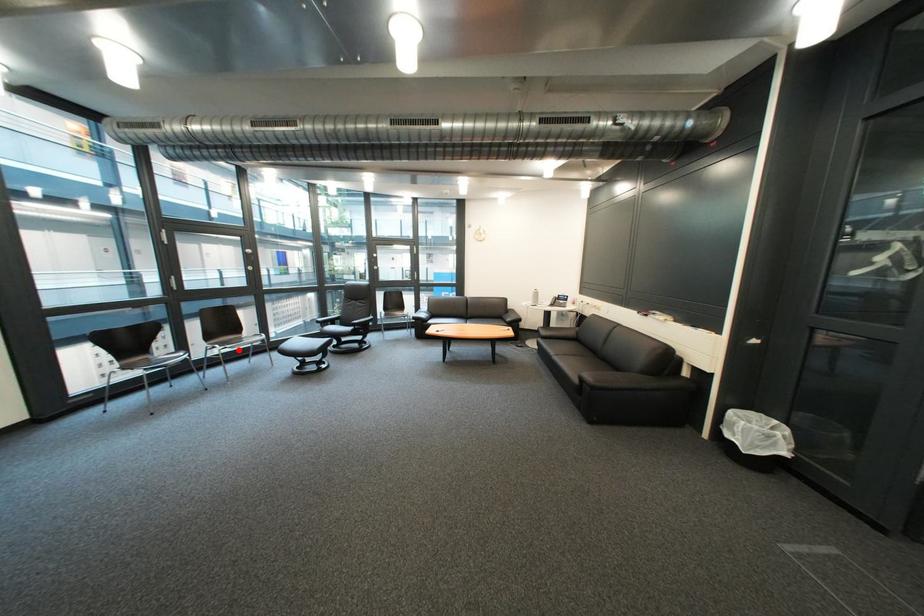
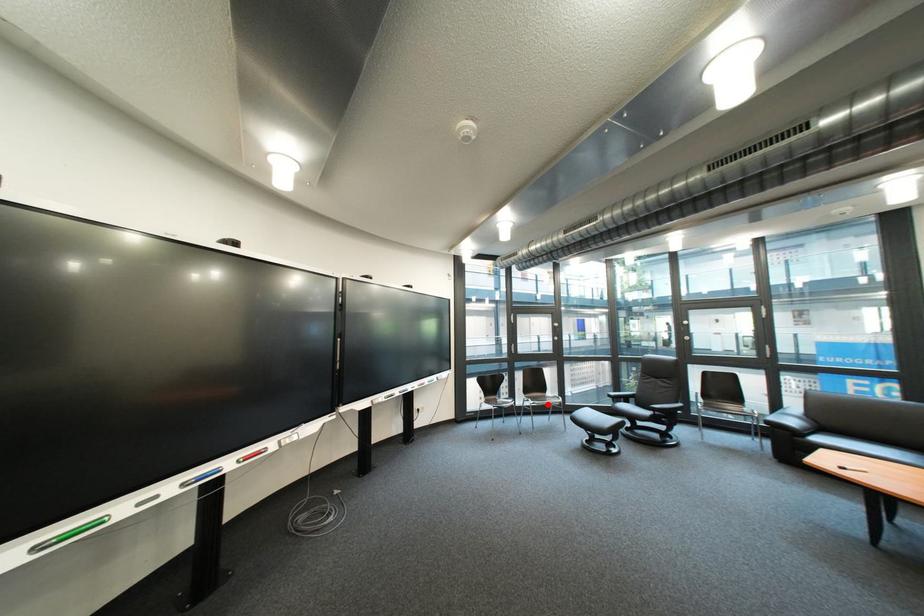
I am providing you with two images of the same scene from different viewpoints. A red point is marked on the first image and another point is marked on the second image. Are the points marked in image1 and image2 representing the same 3D position?

Yes